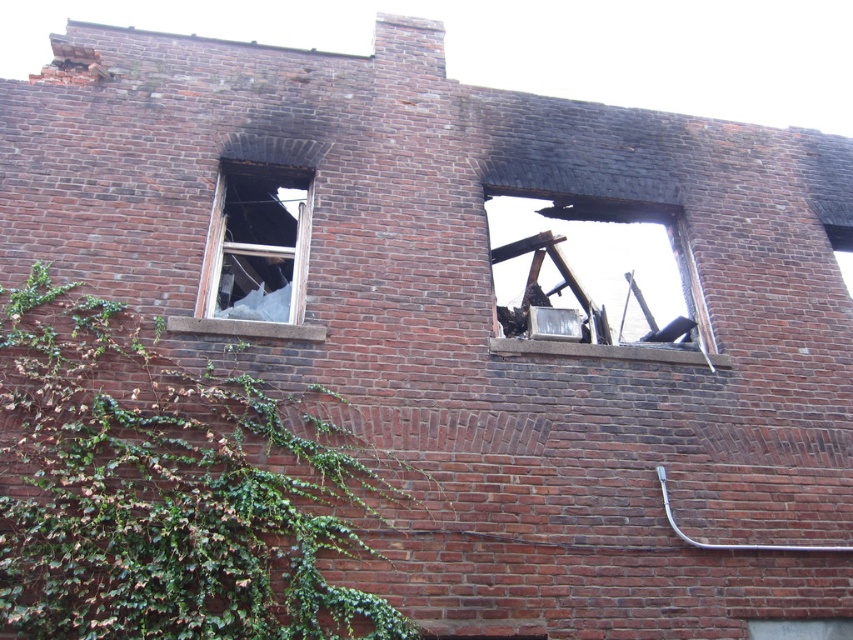
Does green leafy ivy at left appear under transparent glass window at upper left?

Yes, green leafy ivy at left is below transparent glass window at upper left.

Which is below, green leafy ivy at left or transparent glass window at upper left?

green leafy ivy at left is below.

Is point (155, 595) closer to camera compared to point (227, 209)?

Yes, it is.

You are a GUI agent. You are given a task and a screenshot of the screen. Output one action in this format:
    pyautogui.click(x=<x>, y=<y>)
    Task: Click on the green leafy ivy at left
    The image size is (853, 640).
    Given the screenshot: What is the action you would take?
    pyautogui.click(x=164, y=490)

Is green leafy ivy at left closer to camera compared to charcoal wood debris at upper center?

That is True.

Which is behind, point (141, 484) or point (604, 323)?

The point (604, 323) is behind.

In order to click on green leafy ivy at left in this screenshot , I will do `click(164, 490)`.

How far apart are charcoal wood debris at upper center and transparent glass window at upper left?

They are 5.94 feet apart.

Who is more forward, (x=517, y=243) or (x=296, y=216)?

Point (x=296, y=216)

I want to click on charcoal wood debris at upper center, so click(614, 273).